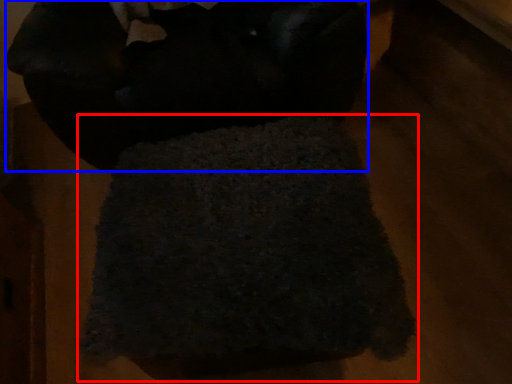
Question: Which object is further to the camera taking this photo, towel (highlighted by a red box) or wool (highlighted by a blue box)?

Choices:
 (A) towel
 (B) wool

Answer: (B)